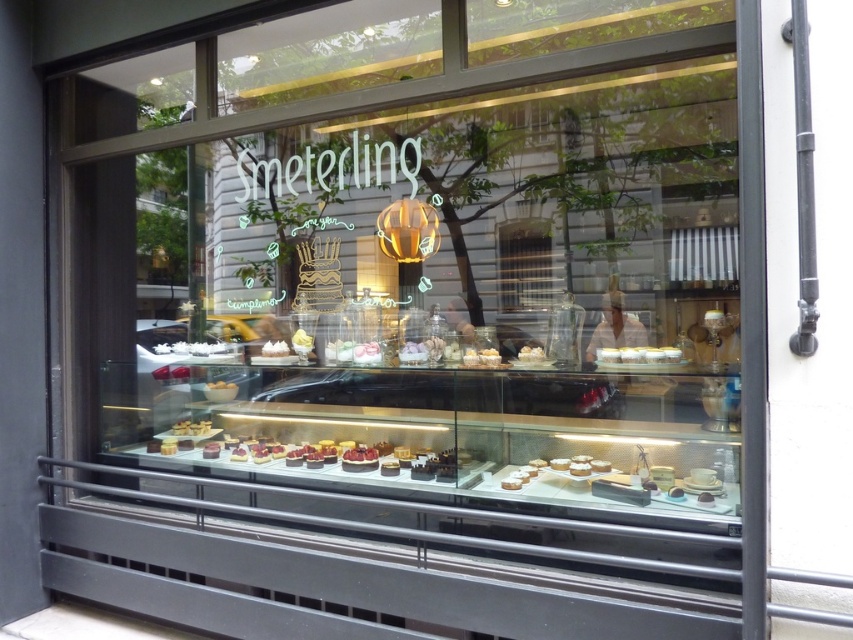
Question: Is white cream cake at center below white glossy cake at center?

Choices:
 (A) yes
 (B) no

Answer: (B)

Question: Which object appears farthest from the camera in this image?

Choices:
 (A) white glossy cake at center
 (B) white cream cake at center

Answer: (B)

Question: Is white cream cake at center bigger than white glossy cake at center?

Choices:
 (A) no
 (B) yes

Answer: (B)

Question: Can you confirm if white cream cake at center is thinner than white glossy cake at center?

Choices:
 (A) no
 (B) yes

Answer: (A)

Question: Which object is closer to the camera taking this photo?

Choices:
 (A) white cream cake at center
 (B) white glossy cake at center

Answer: (B)